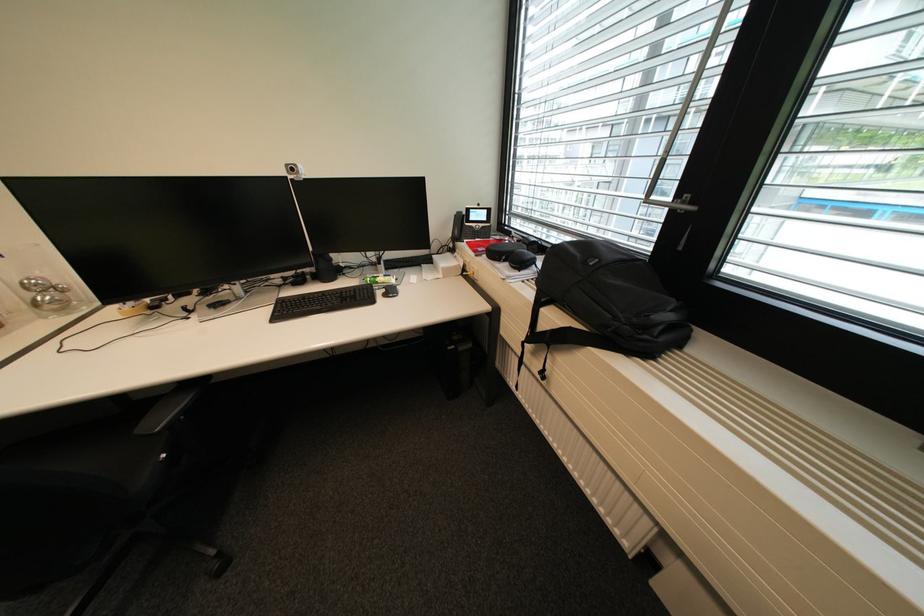
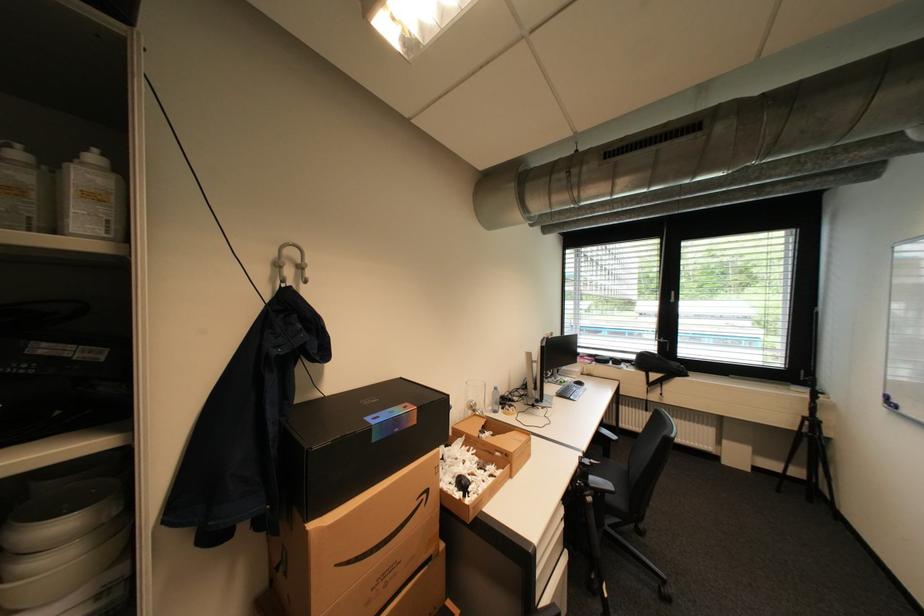
Find the pixel in the second image that matches (40,281) in the first image.

(480, 402)